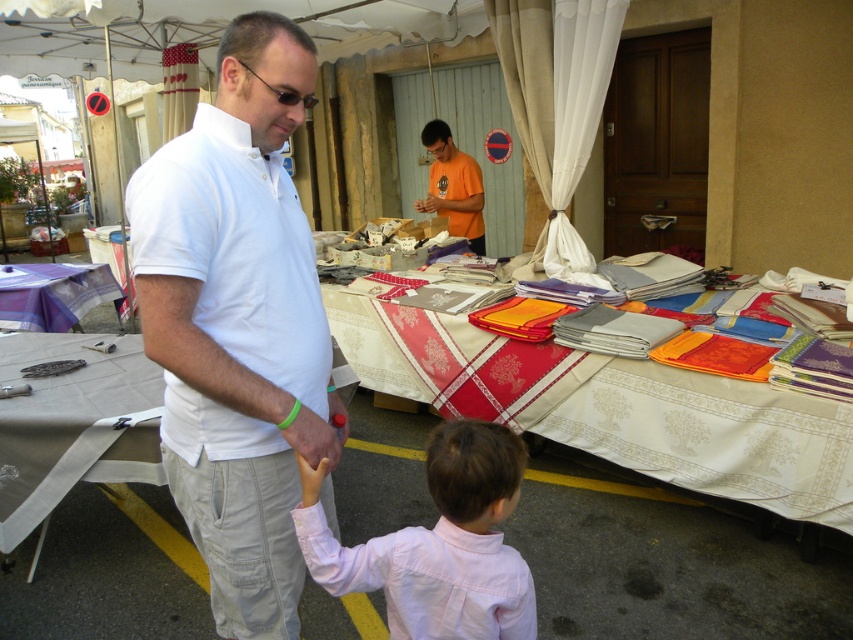
Question: Estimate the real-world distances between objects in this image. Which object is closer to the white embroidered tablecloth at center?

Choices:
 (A) white cotton shirt at center
 (B) orange cotton t-shirt at center
 (C) pink cotton shirt at lower center

Answer: (C)

Question: Can you confirm if white cotton shirt at center is positioned to the left of pink cotton shirt at lower center?

Choices:
 (A) yes
 (B) no

Answer: (A)

Question: Which is farther from the white embroidered tablecloth at center?

Choices:
 (A) orange cotton t-shirt at center
 (B) white cotton shirt at center
 (C) white fabric table at left
 (D) pink cotton shirt at lower center

Answer: (A)

Question: Does white cotton shirt at center have a lesser width compared to white embroidered tablecloth at center?

Choices:
 (A) yes
 (B) no

Answer: (A)

Question: From the image, what is the correct spatial relationship of white cotton shirt at center in relation to white fabric table at left?

Choices:
 (A) right
 (B) left

Answer: (A)

Question: Considering the real-world distances, which object is closest to the white fabric table at left?

Choices:
 (A) white cotton shirt at center
 (B) pink cotton shirt at lower center
 (C) white embroidered tablecloth at center

Answer: (A)